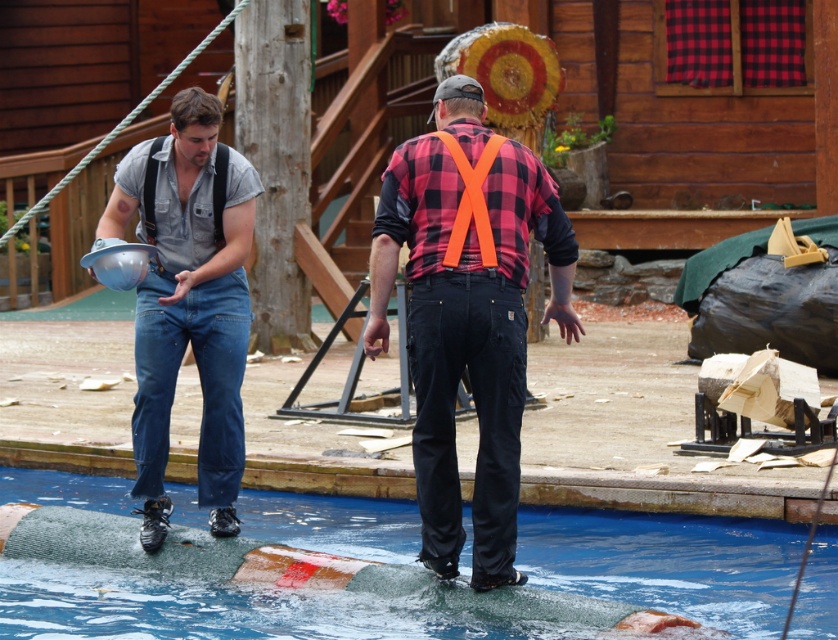
Based on the photo, is denim overalls at left in front of black fabric suspenders at left?

Yes, it is.

Which is behind, point (190, 236) or point (153, 193)?

Positioned behind is point (190, 236).

Where is `denim overalls at left`? The image size is (838, 640). denim overalls at left is located at coordinates (189, 301).

This screenshot has width=838, height=640. Find the location of `denim overalls at left`. denim overalls at left is located at coordinates (189, 301).

Who is shorter, blue rubber mat at lower center or black fabric suspenders at left?

Standing shorter between the two is blue rubber mat at lower center.

Measure the distance between point (803, 532) and camera.

Point (803, 532) and camera are 12.31 meters apart.

Which is behind, point (397, 525) or point (148, 196)?

Point (397, 525)

At what (x,y) coordinates should I click in order to perform the action: click on blue rubber mat at lower center. Please return your answer as a coordinate pair (x, y). This screenshot has width=838, height=640. Looking at the image, I should click on (666, 563).

Who is lower down, blue rubber mat at lower center or plaid fabric shirt at center?

blue rubber mat at lower center is below.

What do you see at coordinates (666, 563) in the screenshot?
I see `blue rubber mat at lower center` at bounding box center [666, 563].

Locate an element on the screen. The height and width of the screenshot is (640, 838). blue rubber mat at lower center is located at coordinates (666, 563).